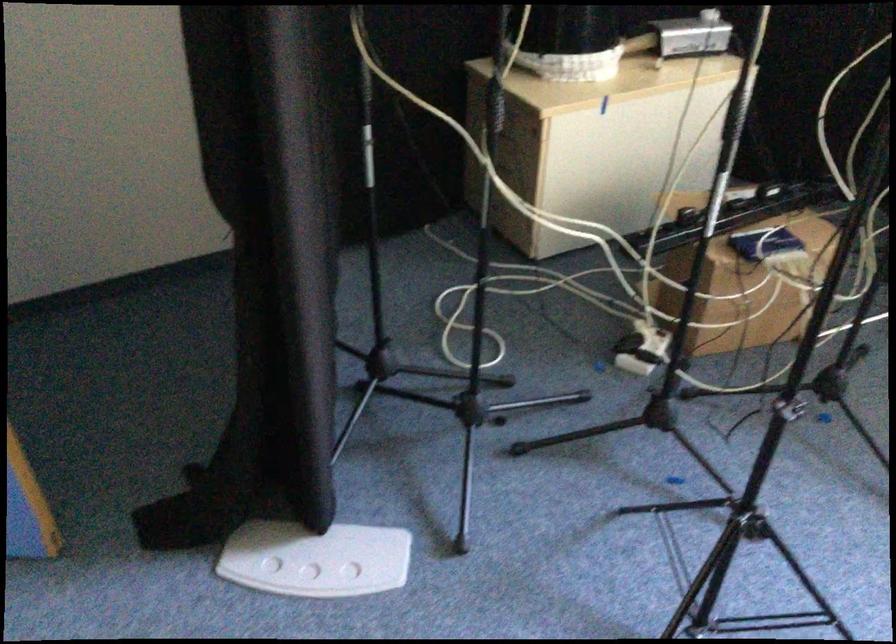
Where would you press the white foot pedal? Please return your answer as a coordinate pair (x, y).

(315, 559)